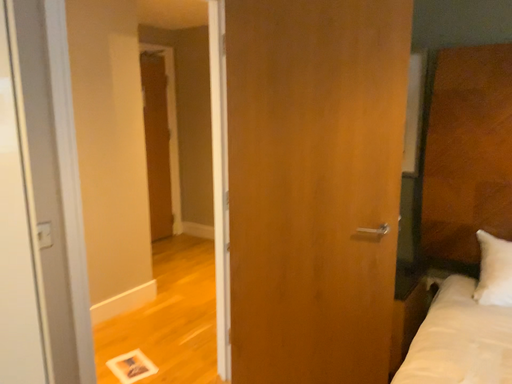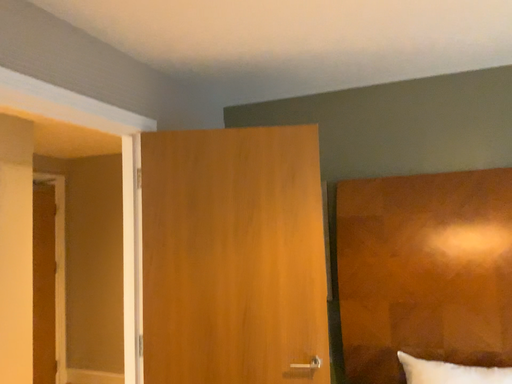
Question: Which way did the camera rotate in the video?

Choices:
 (A) rotated downward
 (B) rotated upward

Answer: (B)